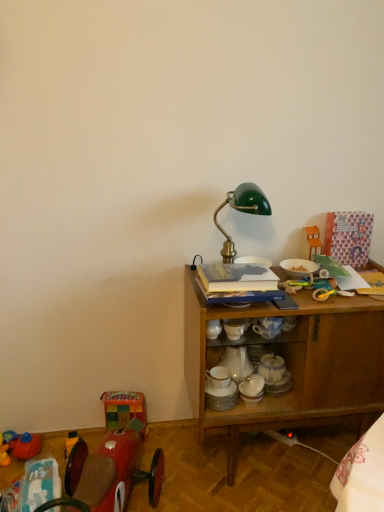
Question: From the image's perspective, does hardcover book at center appear higher than wooden cabinet at right?

Choices:
 (A) no
 (B) yes

Answer: (B)

Question: Is hardcover book at center closer to the viewer compared to wooden cabinet at right?

Choices:
 (A) yes
 (B) no

Answer: (A)

Question: Is hardcover book at center next to wooden cabinet at right?

Choices:
 (A) yes
 (B) no

Answer: (B)

Question: Does hardcover book at center appear on the right side of wooden cabinet at right?

Choices:
 (A) no
 (B) yes

Answer: (A)

Question: Does hardcover book at center turn towards wooden cabinet at right?

Choices:
 (A) no
 (B) yes

Answer: (A)

Question: Is hardcover book at center turned away from wooden cabinet at right?

Choices:
 (A) yes
 (B) no

Answer: (B)

Question: From a real-world perspective, is green glass table lamp at center on top of orange plastic toy house at upper right, the 4th toy from the left?

Choices:
 (A) yes
 (B) no

Answer: (A)

Question: Is green glass table lamp at center to the left of orange plastic toy house at upper right, the 1th toy positioned from the top, from the viewer's perspective?

Choices:
 (A) no
 (B) yes

Answer: (B)

Question: Is green glass table lamp at center shorter than orange plastic toy house at upper right, positioned as the 4th toy in bottom-to-top order?

Choices:
 (A) no
 (B) yes

Answer: (A)

Question: Is green glass table lamp at center bigger than orange plastic toy house at upper right, the 1th toy positioned from the top?

Choices:
 (A) yes
 (B) no

Answer: (A)

Question: Are green glass table lamp at center and orange plastic toy house at upper right, the 1th toy positioned from the top, located far from each other?

Choices:
 (A) yes
 (B) no

Answer: (B)

Question: Can you confirm if green glass table lamp at center is positioned to the right of orange plastic toy house at upper right, the 1th toy positioned from the top?

Choices:
 (A) yes
 (B) no

Answer: (B)

Question: Can you confirm if shiny red car at lower left, which is counted as the 3th toy, starting from the top, is taller than green glass table lamp at center?

Choices:
 (A) no
 (B) yes

Answer: (B)